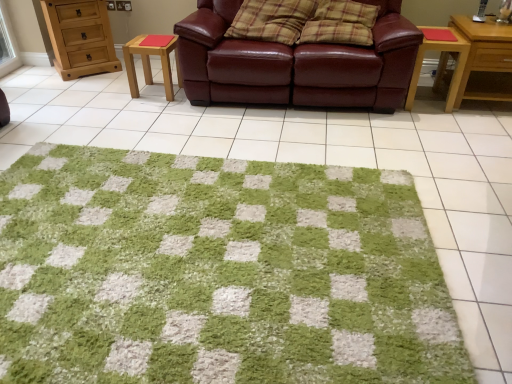
Locate an element on the screen. vacant region under wooden stool at center-left, the 2th table from the right (from a real-world perspective) is located at coordinates (156, 89).